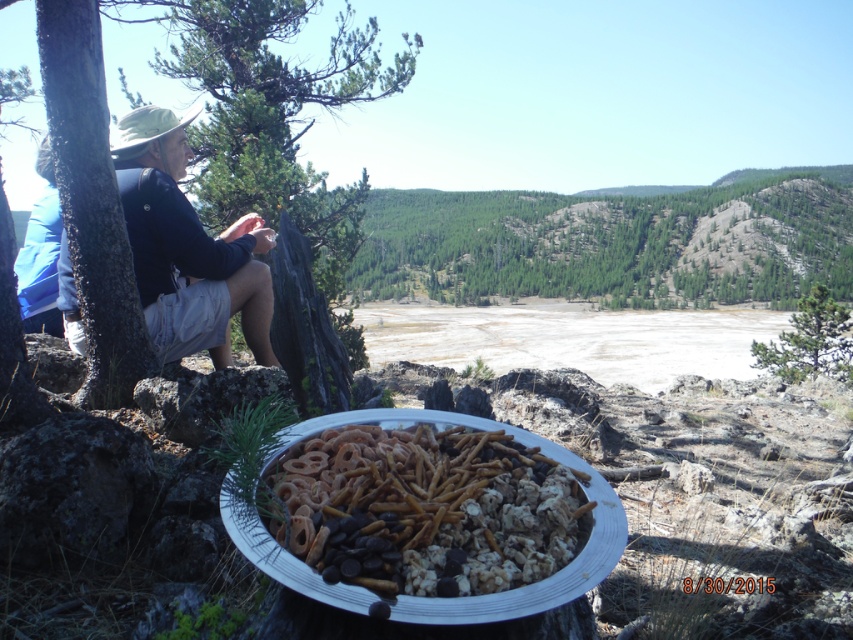
Is golden crunchy pretzels at center above green textured pine tree at center?

Actually, golden crunchy pretzels at center is below green textured pine tree at center.

Can you confirm if golden crunchy pretzels at center is wider than green textured pine tree at center?

No.

Locate an element on the screen. golden crunchy pretzels at center is located at coordinates (428, 508).

Locate an element on the screen. golden crunchy pretzels at center is located at coordinates (428, 508).

Can you confirm if green leafy tree at center is positioned to the right of green leafy tree at left?

Correct, you'll find green leafy tree at center to the right of green leafy tree at left.

Can you confirm if green leafy tree at center is shorter than green leafy tree at left?

Correct, green leafy tree at center is not as tall as green leafy tree at left.

Between point (415, 257) and point (347, 333), which one is positioned behind?

The point (415, 257) is behind.

Where is `green leafy tree at center`? The image size is (853, 640). green leafy tree at center is located at coordinates (613, 243).

Can you confirm if green leafy tree at center is bigger than golden crunchy pretzels at center?

Yes, green leafy tree at center is bigger than golden crunchy pretzels at center.

Can you confirm if green leafy tree at center is shorter than golden crunchy pretzels at center?

No, green leafy tree at center is not shorter than golden crunchy pretzels at center.

At what (x,y) coordinates should I click in order to perform the action: click on green leafy tree at center. Please return your answer as a coordinate pair (x, y). Image resolution: width=853 pixels, height=640 pixels. Looking at the image, I should click on (613, 243).

At what (x,y) coordinates should I click in order to perform the action: click on green leafy tree at center. Please return your answer as a coordinate pair (x, y). This screenshot has width=853, height=640. Looking at the image, I should click on (613, 243).